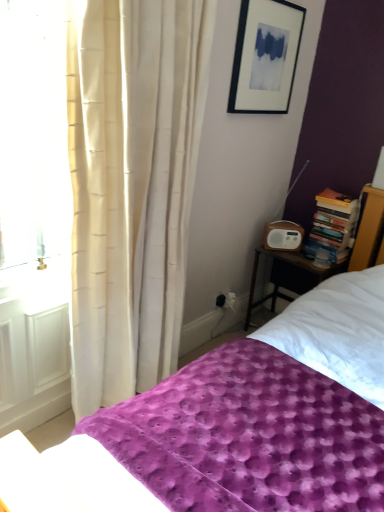
Question: Would you say purple textured blanket at lower center contains black matte picture frame at upper center?

Choices:
 (A) no
 (B) yes

Answer: (A)

Question: Can you see purple textured blanket at lower center touching black matte picture frame at upper center?

Choices:
 (A) yes
 (B) no

Answer: (B)

Question: Can you confirm if purple textured blanket at lower center is bigger than black matte picture frame at upper center?

Choices:
 (A) yes
 (B) no

Answer: (A)

Question: Does purple textured blanket at lower center come behind black matte picture frame at upper center?

Choices:
 (A) no
 (B) yes

Answer: (A)

Question: From the image's perspective, is purple textured blanket at lower center beneath black matte picture frame at upper center?

Choices:
 (A) yes
 (B) no

Answer: (A)

Question: Is purple textured blanket at lower center far away from black matte picture frame at upper center?

Choices:
 (A) no
 (B) yes

Answer: (B)

Question: Considering the relative sizes of hardcover books at right and black matte picture frame at upper center in the image provided, is hardcover books at right shorter than black matte picture frame at upper center?

Choices:
 (A) yes
 (B) no

Answer: (A)

Question: Can we say hardcover books at right lies outside black matte picture frame at upper center?

Choices:
 (A) no
 (B) yes

Answer: (B)

Question: Considering the relative positions of hardcover books at right and black matte picture frame at upper center in the image provided, is hardcover books at right in front of black matte picture frame at upper center?

Choices:
 (A) no
 (B) yes

Answer: (A)

Question: From the image's perspective, is hardcover books at right above black matte picture frame at upper center?

Choices:
 (A) yes
 (B) no

Answer: (B)

Question: Is hardcover books at right further to the viewer compared to black matte picture frame at upper center?

Choices:
 (A) yes
 (B) no

Answer: (A)

Question: Is hardcover books at right positioned with its back to black matte picture frame at upper center?

Choices:
 (A) yes
 (B) no

Answer: (B)

Question: Is purple textured blanket at lower center wider than hardcover books at right?

Choices:
 (A) no
 (B) yes

Answer: (B)